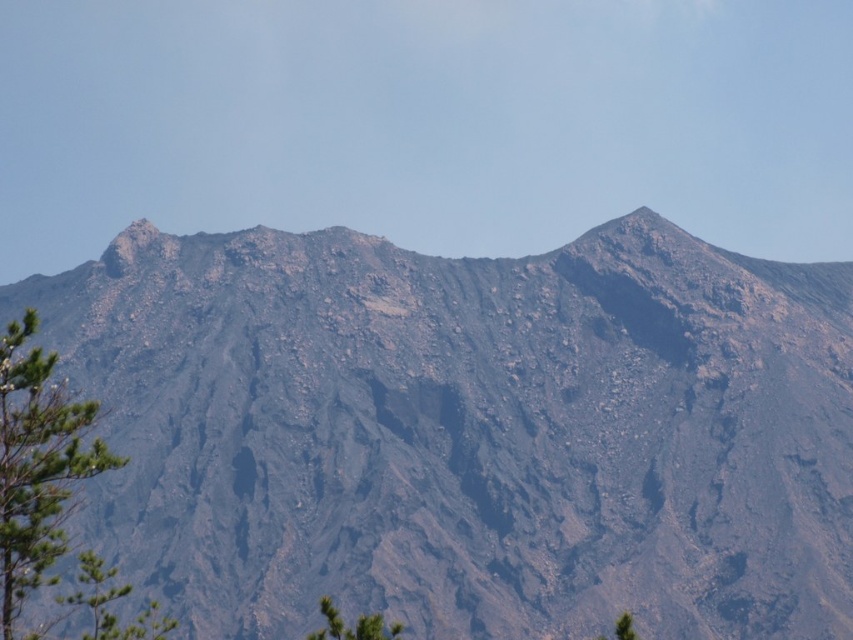
You are a GUI agent. You are given a task and a screenshot of the screen. Output one action in this format:
    pyautogui.click(x=<x>, y=<y>)
    Task: Click on the rugged stone mountain at center
    The height and width of the screenshot is (640, 853).
    Given the screenshot: What is the action you would take?
    pyautogui.click(x=467, y=432)

Who is shorter, rugged stone mountain at center or green leafy tree at lower left?

Standing shorter between the two is green leafy tree at lower left.

Which is behind, point (704, 545) or point (335, 611)?

Positioned behind is point (704, 545).

At what (x,y) coordinates should I click in order to perform the action: click on rugged stone mountain at center. Please return your answer as a coordinate pair (x, y). Looking at the image, I should click on (467, 432).

Which is above, green leafy tree at left or green leafy tree at lower left?

Positioned higher is green leafy tree at left.

Which is behind, point (140, 627) or point (357, 636)?

Point (140, 627)

Does point (91, 417) lie behind point (363, 616)?

No, it is not.

Locate an element on the screen. This screenshot has height=640, width=853. green leafy tree at left is located at coordinates (38, 468).

Is point (697, 358) positioned behind point (71, 404)?

Yes, point (697, 358) is behind point (71, 404).

Is the position of rugged stone mountain at center more distant than that of green leafy tree at left?

Yes, rugged stone mountain at center is behind green leafy tree at left.

Locate an element on the screen. The width and height of the screenshot is (853, 640). rugged stone mountain at center is located at coordinates [467, 432].